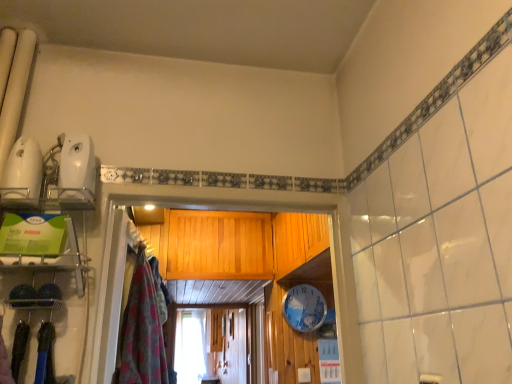
Describe the element at coordinates (141, 331) in the screenshot. The width and height of the screenshot is (512, 384). I see `fluffy pink towel at left` at that location.

You are a GUI agent. You are given a task and a screenshot of the screen. Output one action in this format:
    pyautogui.click(x=<x>, y=<y>)
    Task: Click on the fluffy pink towel at left
    
    Given the screenshot: What is the action you would take?
    pyautogui.click(x=141, y=331)

This screenshot has height=384, width=512. What do you see at coordinates (304, 308) in the screenshot?
I see `white plastic clock at center` at bounding box center [304, 308].

Where is `white plastic clock at center`? The width and height of the screenshot is (512, 384). white plastic clock at center is located at coordinates (304, 308).

Where is `fluffy pink towel at left`? fluffy pink towel at left is located at coordinates click(x=141, y=331).

Which object is positioned more to the right, white plastic clock at center or fluffy pink towel at left?

Positioned to the right is white plastic clock at center.

Is white plastic clock at center further to the viewer compared to fluffy pink towel at left?

Yes, it is behind fluffy pink towel at left.

Considering the positions of point (295, 305) and point (126, 338), is point (295, 305) closer or farther from the camera than point (126, 338)?

Point (295, 305) is farther from the camera than point (126, 338).

From the image's perspective, which object appears higher, white plastic clock at center or fluffy pink towel at left?

fluffy pink towel at left appears higher in the image.

From a real-world perspective, is white plastic clock at center positioned above or below fluffy pink towel at left?

white plastic clock at center is above fluffy pink towel at left.

Does white plastic clock at center have a lesser width compared to fluffy pink towel at left?

Indeed, white plastic clock at center has a lesser width compared to fluffy pink towel at left.

Does white plastic clock at center have a lesser height compared to fluffy pink towel at left?

Indeed, white plastic clock at center has a lesser height compared to fluffy pink towel at left.

Which of these two, white plastic clock at center or fluffy pink towel at left, is bigger?

Bigger between the two is fluffy pink towel at left.

Is white plastic clock at center outside of fluffy pink towel at left?

Indeed, white plastic clock at center is completely outside fluffy pink towel at left.

Is white plastic clock at center not near fluffy pink towel at left?

That's right, there is a large distance between white plastic clock at center and fluffy pink towel at left.

Is white plastic clock at center oriented away from fluffy pink towel at left?

No, white plastic clock at center is not facing away from fluffy pink towel at left.

Identify the location of clothing directly beneath the white plastic clock at center (from a real-world perspective). (141, 331).

Is fluffy pink towel at left at the right side of white plastic clock at center?

In fact, fluffy pink towel at left is to the left of white plastic clock at center.

Considering their positions, is fluffy pink towel at left located in front of or behind white plastic clock at center?

Visually, fluffy pink towel at left is located in front of white plastic clock at center.

Which point is more distant from viewer, (145, 258) or (302, 301)?

The point (302, 301) is farther.

From the image's perspective, which one is positioned lower, fluffy pink towel at left or white plastic clock at center?

white plastic clock at center.

In the scene shown: From a real-world perspective, is fluffy pink towel at left under white plastic clock at center?

Correct, in the physical world, fluffy pink towel at left is lower than white plastic clock at center.

Does fluffy pink towel at left have a greater width compared to white plastic clock at center?

Correct, the width of fluffy pink towel at left exceeds that of white plastic clock at center.

Considering the sizes of objects fluffy pink towel at left and white plastic clock at center in the image provided, who is taller, fluffy pink towel at left or white plastic clock at center?

Standing taller between the two is fluffy pink towel at left.

Looking at the image, does fluffy pink towel at left seem bigger or smaller compared to white plastic clock at center?

Clearly, fluffy pink towel at left is larger in size than white plastic clock at center.

Is white plastic clock at center surrounded by fluffy pink towel at left?

No, white plastic clock at center is not a part of fluffy pink towel at left.

Is fluffy pink towel at left in contact with white plastic clock at center?

No.

Is fluffy pink towel at left facing towards white plastic clock at center?

No, fluffy pink towel at left does not turn towards white plastic clock at center.

How many degrees apart are the facing directions of fluffy pink towel at left and white plastic clock at center?

The angle between the facing direction of fluffy pink towel at left and the facing direction of white plastic clock at center is 85.8 degrees.

This screenshot has width=512, height=384. I want to click on clothing in front of the white plastic clock at center, so [x=141, y=331].

Find the location of `clothing in front of the white plastic clock at center`. clothing in front of the white plastic clock at center is located at coordinates (141, 331).

This screenshot has height=384, width=512. Find the location of `clothing located on the left of white plastic clock at center`. clothing located on the left of white plastic clock at center is located at coordinates (141, 331).